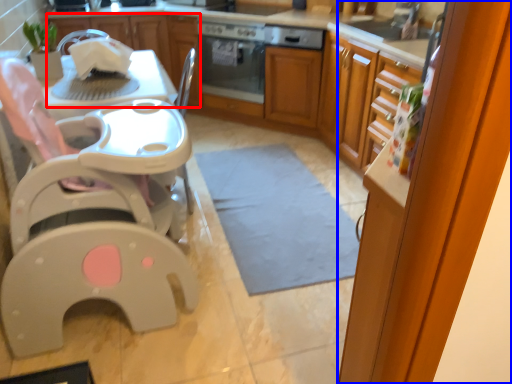
Question: Among these objects, which one is farthest to the camera, cabinetry (highlighted by a red box) or screen door (highlighted by a blue box)?

Choices:
 (A) cabinetry
 (B) screen door

Answer: (A)